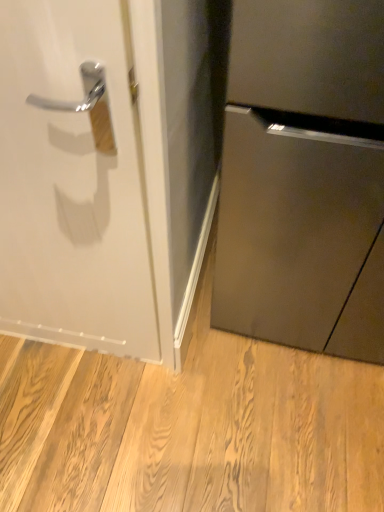
Measure the distance between satin black refrigerator at right and camera.

27.57 inches.

What do you see at coordinates (304, 177) in the screenshot? I see `satin black refrigerator at right` at bounding box center [304, 177].

What is the approximate height of satin black refrigerator at right?

satin black refrigerator at right is 1.11 meters in height.

The width and height of the screenshot is (384, 512). Identify the location of satin black refrigerator at right. (304, 177).

The height and width of the screenshot is (512, 384). What are the coordinates of `satin black refrigerator at right` in the screenshot? It's located at (304, 177).